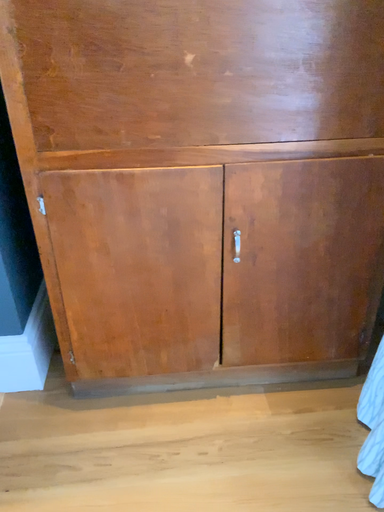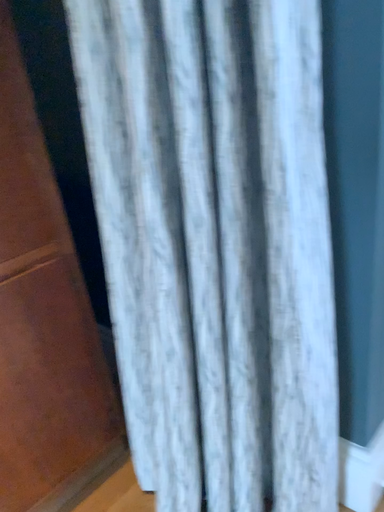
Question: Which way did the camera rotate in the video?

Choices:
 (A) rotated upward
 (B) rotated downward

Answer: (A)